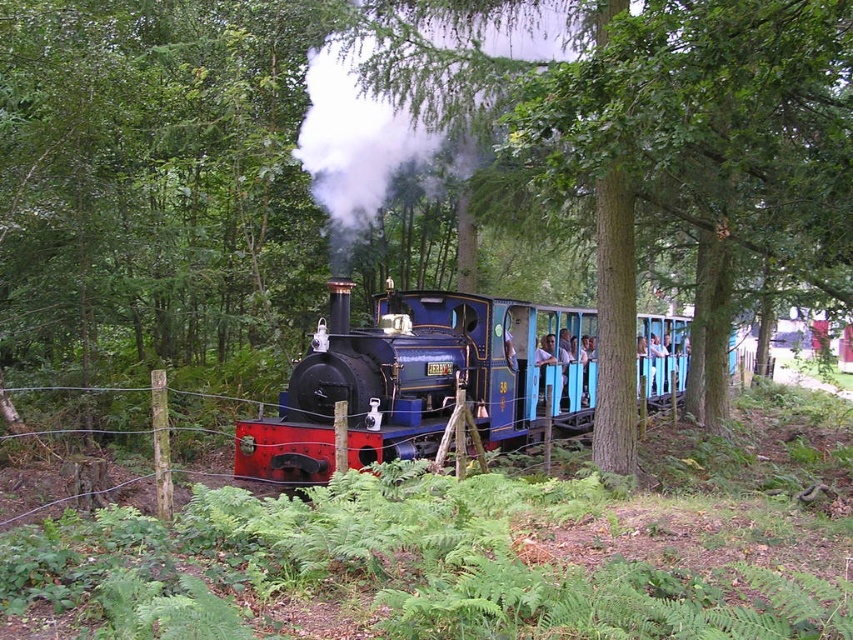
Question: Can you confirm if shiny blue locomotive at center is positioned to the right of polished black locomotive at center?

Choices:
 (A) no
 (B) yes

Answer: (B)

Question: Which point appears closest to the camera in this image?

Choices:
 (A) (154, 390)
 (B) (677, 372)
 (C) (326, 344)

Answer: (A)

Question: Among these objects, which one is farthest from the camera?

Choices:
 (A) polished black locomotive at center
 (B) wire mesh fence at center
 (C) shiny blue locomotive at center

Answer: (A)

Question: Is shiny blue locomotive at center to the right of wire mesh fence at center from the viewer's perspective?

Choices:
 (A) no
 (B) yes

Answer: (A)

Question: Can you confirm if shiny blue locomotive at center is thinner than polished black locomotive at center?

Choices:
 (A) no
 (B) yes

Answer: (A)

Question: Based on their relative distances, which object is farther from the wire mesh fence at center?

Choices:
 (A) polished black locomotive at center
 (B) shiny blue locomotive at center

Answer: (A)